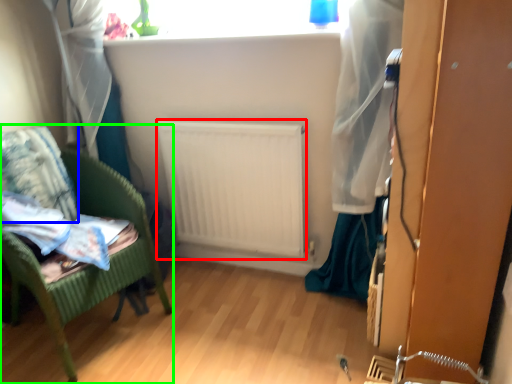
Question: Based on their relative distances, which object is farther from radiator (highlighted by a red box)? Choose from pillow (highlighted by a blue box) and furniture (highlighted by a green box).

Choices:
 (A) pillow
 (B) furniture

Answer: (A)